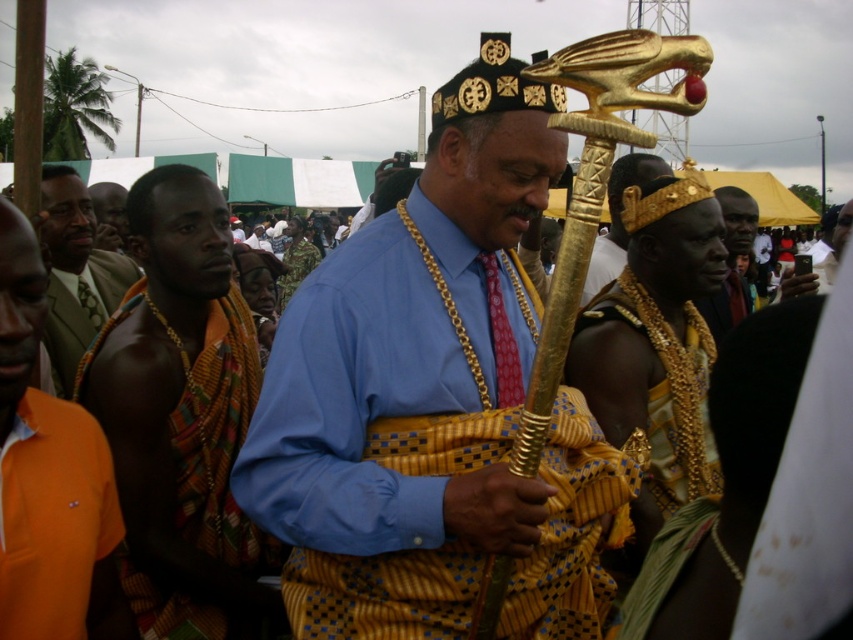
Between gold textured staff at center and orange fabric at left, which one has more height?

Standing taller between the two is gold textured staff at center.

Which is more to the left, gold textured staff at center or orange fabric at left?

orange fabric at left

Locate an element on the screen. The height and width of the screenshot is (640, 853). gold textured staff at center is located at coordinates (433, 401).

Locate an element on the screen. This screenshot has width=853, height=640. gold textured staff at center is located at coordinates (433, 401).

Who is higher up, textured fabric cloth at left or orange fabric at left?

textured fabric cloth at left

Is textured fabric cloth at left thinner than orange fabric at left?

No.

Where is `textured fabric cloth at left`? textured fabric cloth at left is located at coordinates (183, 419).

Is gold textured staff at center to the right of orange woven cloth at left from the viewer's perspective?

Indeed, gold textured staff at center is positioned on the right side of orange woven cloth at left.

Measure the distance between point (x=410, y=332) and camera.

The distance of point (x=410, y=332) from camera is 12.38 feet.

I want to click on gold textured staff at center, so click(x=433, y=401).